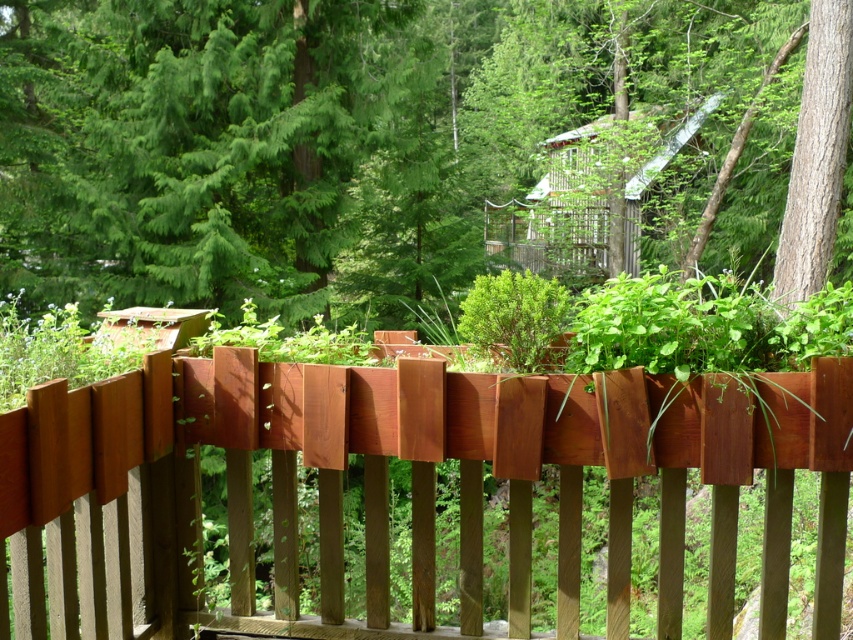
Question: Is green matte tree at center below smooth brown tree trunk at right?

Choices:
 (A) yes
 (B) no

Answer: (B)

Question: Can you confirm if green matte tree at center is positioned above cedar wood fence at center?

Choices:
 (A) yes
 (B) no

Answer: (A)

Question: Estimate the real-world distances between objects in this image. Which object is closer to the smooth brown tree trunk at right?

Choices:
 (A) cedar wood fence at center
 (B) green matte tree at center

Answer: (B)

Question: Does green matte tree at center appear over cedar wood fence at center?

Choices:
 (A) yes
 (B) no

Answer: (A)

Question: Which point appears farthest from the camera in this image?

Choices:
 (A) (811, 248)
 (B) (225, 442)
 (C) (33, 172)

Answer: (C)

Question: Based on their relative distances, which object is nearer to the cedar wood fence at center?

Choices:
 (A) green matte tree at center
 (B) smooth brown tree trunk at right

Answer: (B)